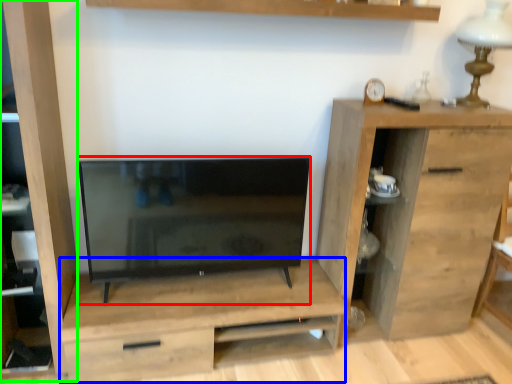
Question: Estimate the real-world distances between objects in this image. Which object is farther from television (highlighted by a red box), dresser (highlighted by a blue box) or cabinet (highlighted by a green box)?

Choices:
 (A) dresser
 (B) cabinet

Answer: (B)